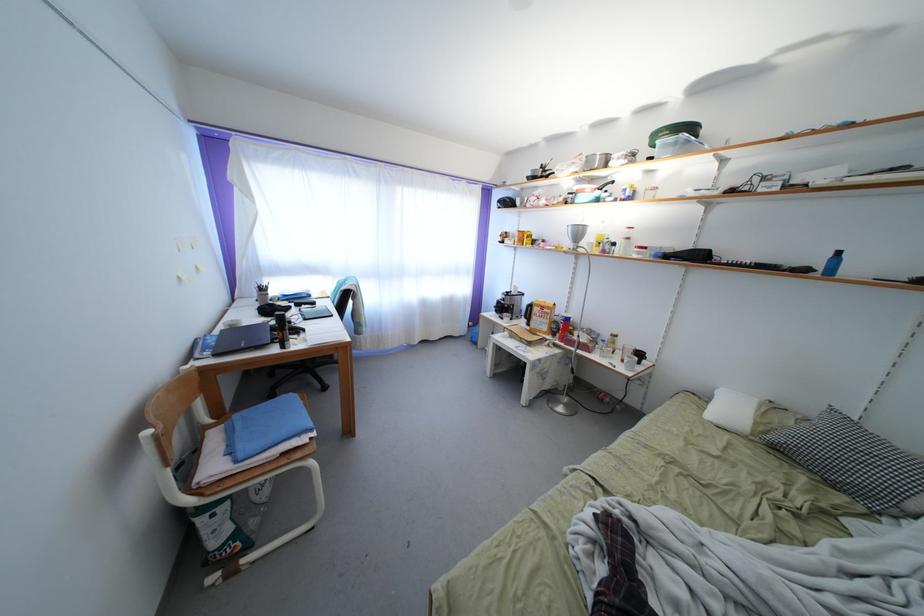
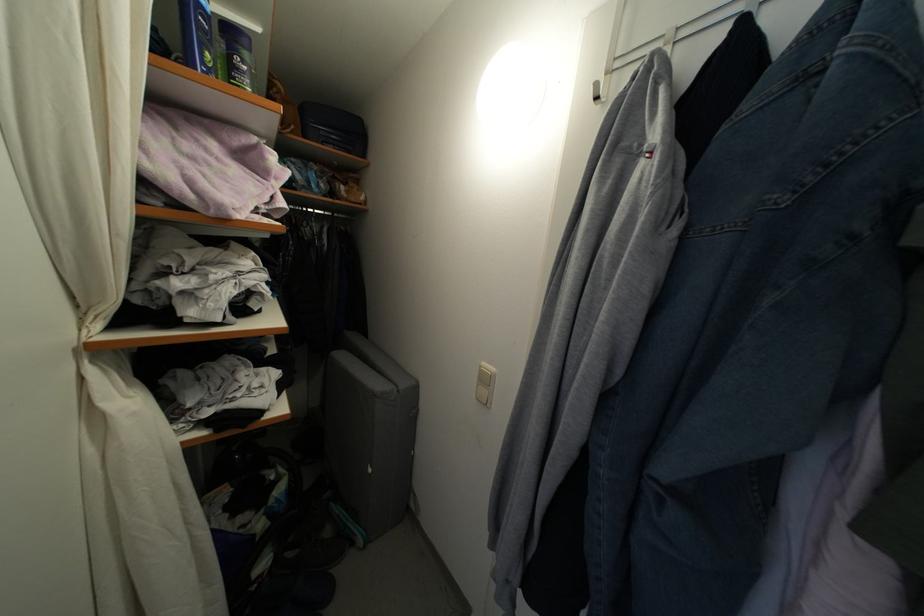
First-person continuous shooting, in which direction is the camera rotating?

The rotation direction of the camera is right-down.